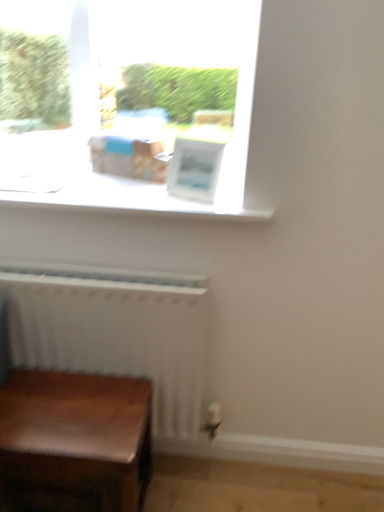
Locate an element on the screen. Image resolution: width=384 pixels, height=512 pixels. vacant area on top of wooden table at lower left (from a real-world perspective) is located at coordinates (77, 402).